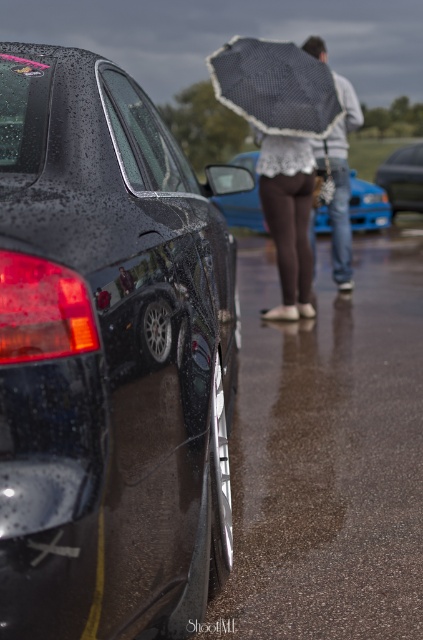
You are standing at the center of the image and want to move towards the shiny black car at left. In which direction should you walk?

The shiny black car at left is located at point 0.559 on the x and 0.258 on the y coordinate, so you should walk towards the lower left direction to reach it.

You are a photographer trying to capture a shot of the brown fabric skirt at center and the white lace umbrella at upper center. Since you want to ensure both are in focus, which object should you adjust your camera focus on first to account for their sizes?

The brown fabric skirt at center has a lesser width compared to white lace umbrella at upper center, so you should focus on the white lace umbrella at upper center first since it is larger and might require more precise focus to capture details.